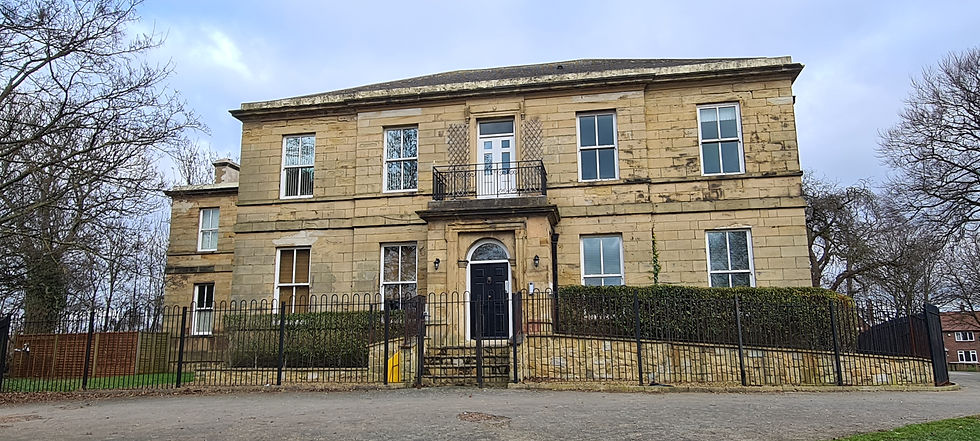
Where is `black door`? black door is located at coordinates (488, 274).